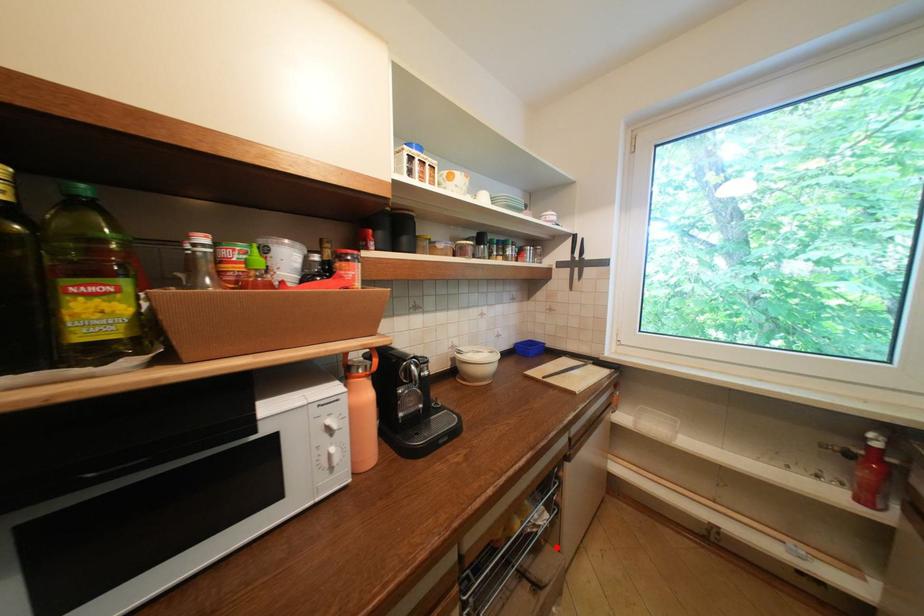
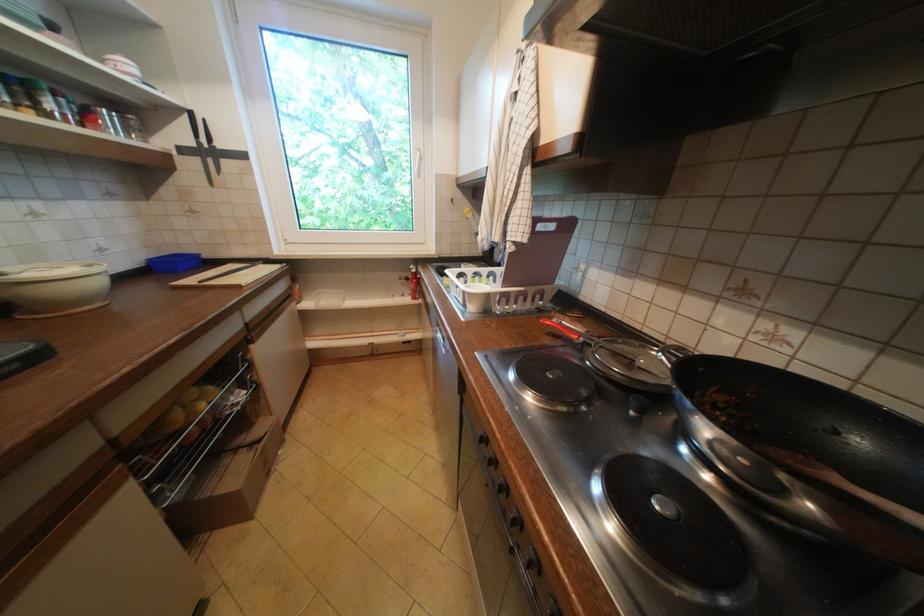
Question: I am providing you with two images of the same scene from different viewpoints. Given a red point in image1, look at the same physical point in image2. Is it:

Choices:
 (A) Closer to the viewpoint
 (B) Farther from the viewpoint

Answer: (A)